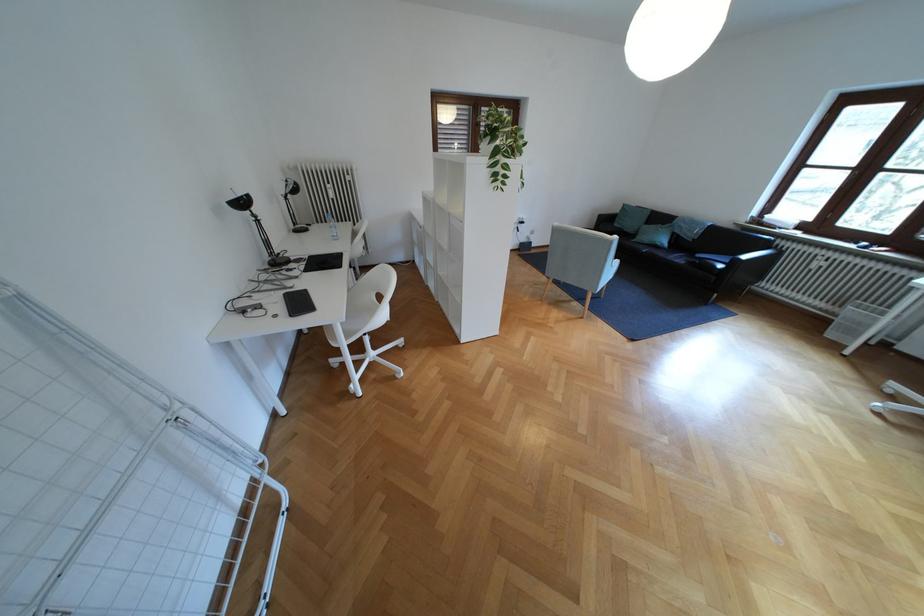
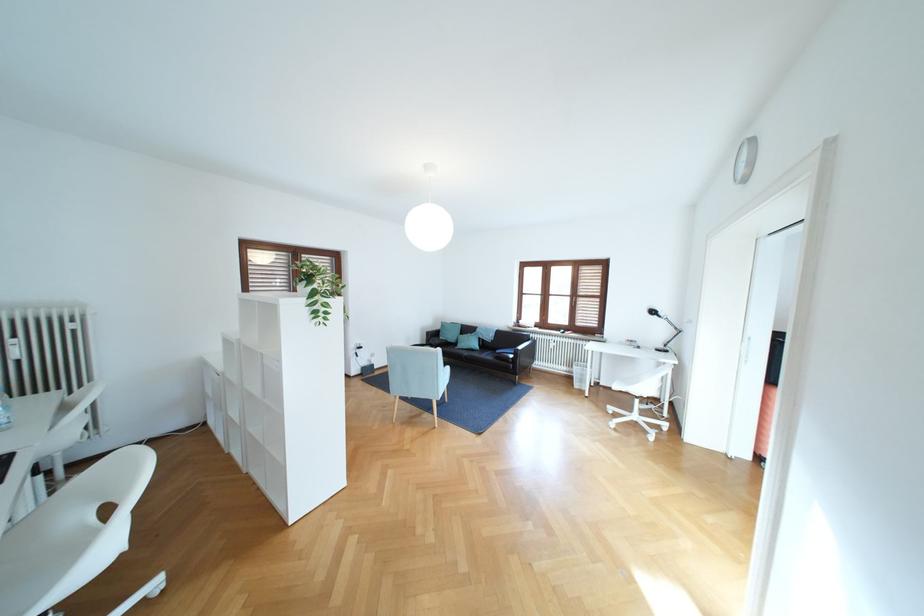
The images are taken continuously from a first-person perspective. In which direction is your viewpoint rotating?

The camera's rotation is toward right-up.